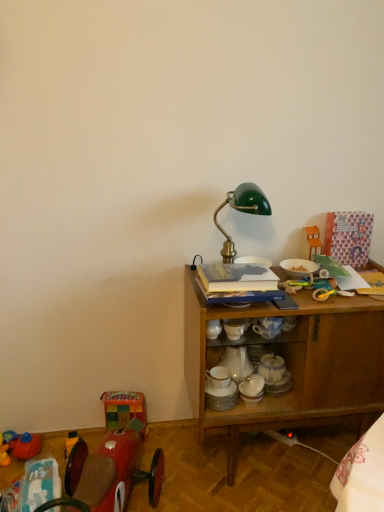
Find the location of a particular element. The width and height of the screenshot is (384, 512). free point below wooden cabinet at right (from a real-world perspective) is located at coordinates (280, 461).